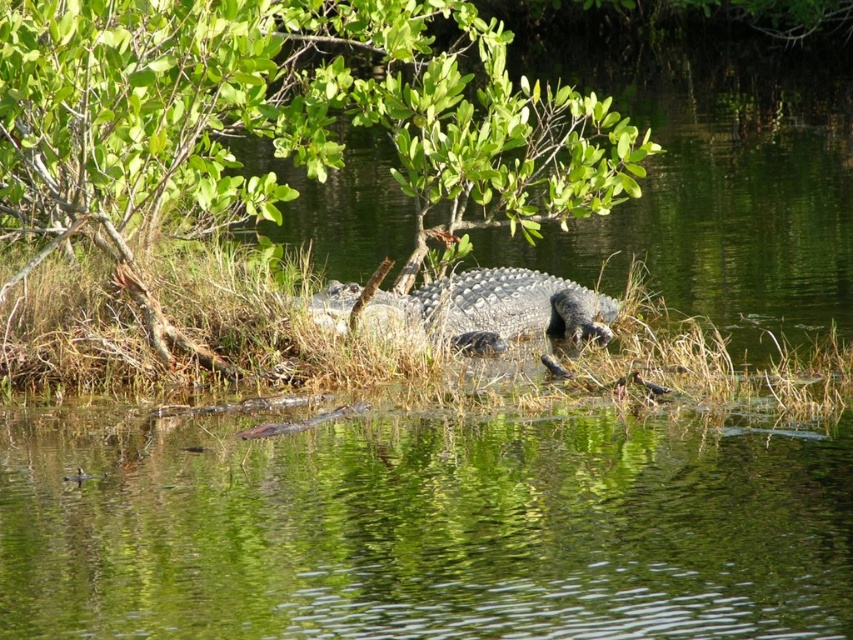
Question: Considering the real-world distances, which object is closest to the scaly gray crocodile at center?

Choices:
 (A) green reflective water at center
 (B) green leafy tree at center

Answer: (B)

Question: Can you confirm if green rough grass at center is positioned below scaly gray crocodile at center?

Choices:
 (A) no
 (B) yes

Answer: (B)

Question: Which of the following is the closest to the observer?

Choices:
 (A) (419, 304)
 (B) (219, 369)

Answer: (B)

Question: Among these points, which one is farthest from the camera?

Choices:
 (A) (396, 300)
 (B) (18, 236)
 (C) (149, 278)
 (D) (467, 525)

Answer: (B)

Question: Is the position of green reflective water at center less distant than that of scaly gray crocodile at center?

Choices:
 (A) no
 (B) yes

Answer: (B)

Question: Can you confirm if green reflective water at center is positioned to the right of green leafy tree at center?

Choices:
 (A) yes
 (B) no

Answer: (A)